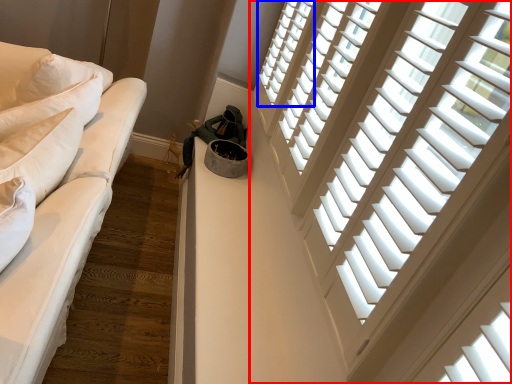
Question: Which of the following is the farthest to the observer, window (highlighted by a red box) or window (highlighted by a blue box)?

Choices:
 (A) window
 (B) window

Answer: (B)